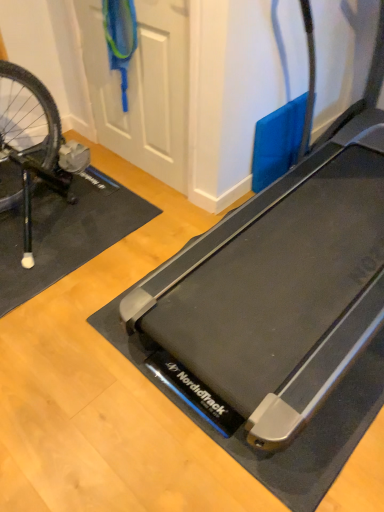
Question: In terms of size, does black rubber treadmill at center appear bigger or smaller than black rubber yoga mat at left?

Choices:
 (A) big
 (B) small

Answer: (A)

Question: In the image, is black rubber treadmill at center on the left side or the right side of black rubber yoga mat at left?

Choices:
 (A) right
 (B) left

Answer: (A)

Question: Which of these objects is positioned closest to the black rubber treadmill at center?

Choices:
 (A) black rubber yoga mat at left
 (B) white matte door at upper center

Answer: (A)

Question: Which object is positioned closest to the white matte door at upper center?

Choices:
 (A) black rubber treadmill at center
 (B) black rubber yoga mat at left

Answer: (B)